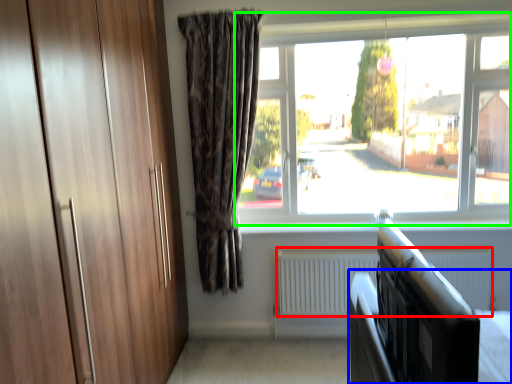
Question: Based on their relative distances, which object is farther from radiator (highlighted by a red box)? Choose from bed frame (highlighted by a blue box) and window (highlighted by a green box).

Choices:
 (A) bed frame
 (B) window

Answer: (A)